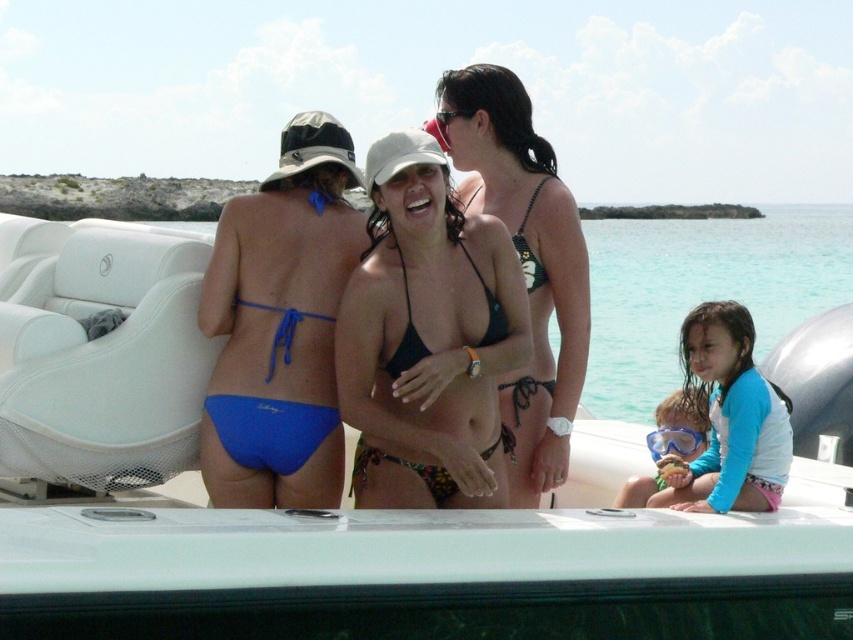
Where is the black bikini top at center located in the image?

The black bikini top at center is located at point (525, 260) in the image.

You are on a boat with a blue rubber snorkel mask at lower center and transparent plastic goggles at lower right. You need to place a small waterproof box between them. Is there enough space?

The blue rubber snorkel mask at lower center is 2.73 inches away from the transparent plastic goggles at lower right. Since the distance between them is 2.73 inches, the small waterproof box can fit as long as its dimensions are smaller than this distance.

You are a photographer on the boat trying to capture a photo of both the blue rubberized swimsuit at lower right and the blue fabric bikini at center. Since you want to ensure both are fully visible in the frame, which swimwear should you position closer to the camera to avoid cropping?

The blue rubberized swimsuit at lower right is wider than the blue fabric bikini at center. To ensure both are fully visible, position the wider blue rubberized swimsuit at lower right closer to the camera so its larger size can fit within the frame without being cropped.